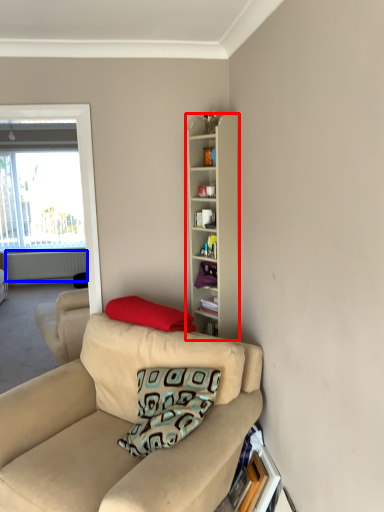
Question: Which point is further to the camera, cabinetry (highlighted by a red box) or radiator (highlighted by a blue box)?

Choices:
 (A) cabinetry
 (B) radiator

Answer: (B)